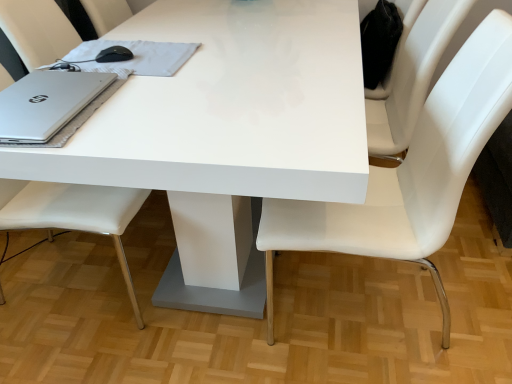
You are a GUI agent. You are given a task and a screenshot of the screen. Output one action in this format:
    pyautogui.click(x=<x>, y=<y>)
    Task: Click on the spots to the right of silver metallic laptop at left
    The height and width of the screenshot is (384, 512).
    Given the screenshot: What is the action you would take?
    pyautogui.click(x=148, y=108)